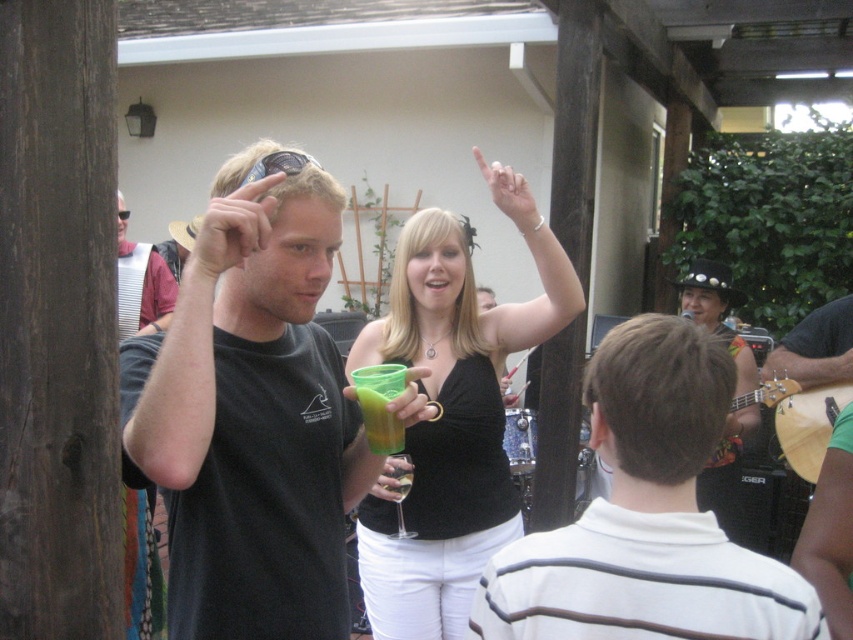
You are taking a photo of two points in the scene. The first point is at position point (497,554) and the second is at point (392,440). Which point will appear larger in your photo?

Point (497,554) is closer to the camera than point (392,440), so it will appear larger in the photo.

You are at a party and want to grab a drink from the green translucent cup at center. However, there is a white striped shirt at center in the way. Can you reach the cup without moving the shirt?

The white striped shirt at center is taller than the green translucent cup at center, so it might block access to the cup. You may need to move the shirt to reach the cup.